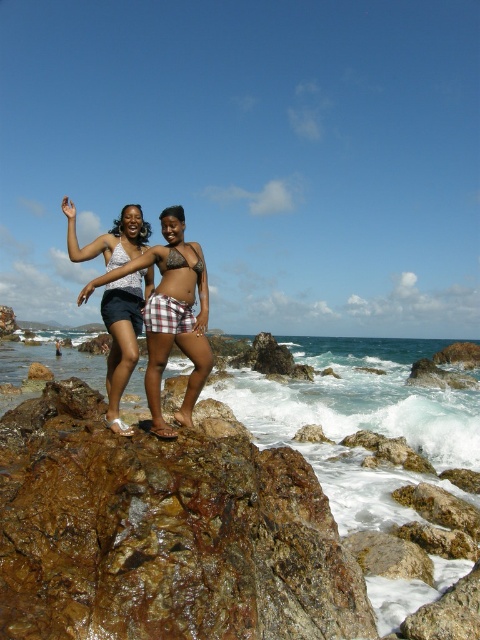
Question: Which of the following is the farthest from the observer?

Choices:
 (A) brown rough rock at center
 (B) brown skin at center
 (C) matte white tank top at center
 (D) matte skin bikini at center

Answer: (D)

Question: Which object appears farthest from the camera in this image?

Choices:
 (A) matte white tank top at center
 (B) white lace bikini top at center
 (C) brown skin at center

Answer: (C)

Question: Does matte skin bikini at center have a lesser width compared to brown skin at center?

Choices:
 (A) yes
 (B) no

Answer: (B)

Question: Is matte white tank top at center bigger than matte skin bikini at center?

Choices:
 (A) no
 (B) yes

Answer: (A)

Question: Observing the image, what is the correct spatial positioning of matte skin bikini at center in reference to white matte bikini top at center?

Choices:
 (A) above
 (B) below

Answer: (A)

Question: Which point is farther to the camera?

Choices:
 (A) (193, 252)
 (B) (108, 394)

Answer: (A)